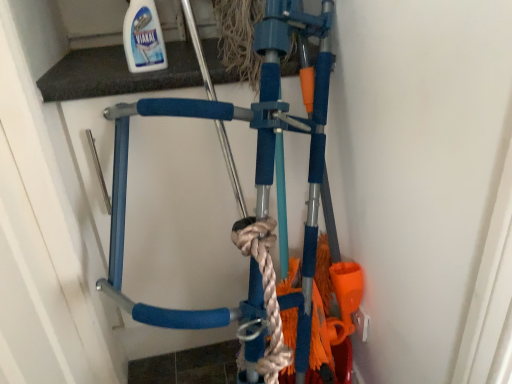
In the scene shown: What is the approximate height of white glossy bottle at upper center?

It is 27.06 centimeters.

Identify the location of white glossy bottle at upper center. The height and width of the screenshot is (384, 512). (143, 38).

Describe the element at coordinates (143, 38) in the screenshot. I see `white glossy bottle at upper center` at that location.

Identify the location of blue foam bicycle at center. The height and width of the screenshot is (384, 512). (242, 195).

The image size is (512, 384). What do you see at coordinates (242, 195) in the screenshot?
I see `blue foam bicycle at center` at bounding box center [242, 195].

Find the location of a particular element. The height and width of the screenshot is (384, 512). white glossy bottle at upper center is located at coordinates (143, 38).

Is white glossy bottle at upper center at the left side of blue foam bicycle at center?

Yes, white glossy bottle at upper center is to the left of blue foam bicycle at center.

Is white glossy bottle at upper center in front of or behind blue foam bicycle at center in the image?

Clearly, white glossy bottle at upper center is in front of blue foam bicycle at center.

Which is behind, point (156, 13) or point (262, 172)?

The point (156, 13) is behind.

From the image's perspective, is white glossy bottle at upper center above or below blue foam bicycle at center?

Based on their image positions, white glossy bottle at upper center is located above blue foam bicycle at center.

From a real-world perspective, is white glossy bottle at upper center positioned above or below blue foam bicycle at center?

Clearly, from a real-world perspective, white glossy bottle at upper center is above blue foam bicycle at center.

From the picture: Considering the sizes of objects white glossy bottle at upper center and blue foam bicycle at center in the image provided, who is wider, white glossy bottle at upper center or blue foam bicycle at center?

blue foam bicycle at center.

Is white glossy bottle at upper center taller than blue foam bicycle at center?

Incorrect, the height of white glossy bottle at upper center is not larger of that of blue foam bicycle at center.

Who is bigger, white glossy bottle at upper center or blue foam bicycle at center?

blue foam bicycle at center.

Is white glossy bottle at upper center inside the boundaries of blue foam bicycle at center, or outside?

white glossy bottle at upper center is located beyond the bounds of blue foam bicycle at center.

Is white glossy bottle at upper center positioned far away from blue foam bicycle at center?

They are positioned close to each other.

Does white glossy bottle at upper center turn towards blue foam bicycle at center?

No, white glossy bottle at upper center is not oriented towards blue foam bicycle at center.

Where is `bicycle below the white glossy bottle at upper center (from a real-world perspective)`? The width and height of the screenshot is (512, 384). bicycle below the white glossy bottle at upper center (from a real-world perspective) is located at coordinates (242, 195).

Can you confirm if blue foam bicycle at center is positioned to the left of white glossy bottle at upper center?

No, blue foam bicycle at center is not to the left of white glossy bottle at upper center.

Who is more distant, blue foam bicycle at center or white glossy bottle at upper center?

Positioned behind is blue foam bicycle at center.

Which is closer to the camera, (300,348) or (152,58)?

Point (300,348).

Based on the photo, from the image's perspective, does blue foam bicycle at center appear lower than white glossy bottle at upper center?

Yes, from the image's perspective, blue foam bicycle at center is below white glossy bottle at upper center.

Based on the photo, from a real-world perspective, is blue foam bicycle at center physically above white glossy bottle at upper center?

No, from a real-world perspective, blue foam bicycle at center is not above white glossy bottle at upper center.

Considering the sizes of blue foam bicycle at center and white glossy bottle at upper center in the image, is blue foam bicycle at center wider or thinner than white glossy bottle at upper center?

In the image, blue foam bicycle at center appears to be wider than white glossy bottle at upper center.

Can you confirm if blue foam bicycle at center is taller than white glossy bottle at upper center?

Correct, blue foam bicycle at center is much taller as white glossy bottle at upper center.

Can you confirm if blue foam bicycle at center is smaller than white glossy bottle at upper center?

No.

Would you say blue foam bicycle at center is outside white glossy bottle at upper center?

Yes.

Is blue foam bicycle at center far from white glossy bottle at upper center?

No, there isn't a large distance between blue foam bicycle at center and white glossy bottle at upper center.

Is blue foam bicycle at center aimed at white glossy bottle at upper center?

No.

Locate an element on the screen. Image resolution: width=512 pixels, height=384 pixels. bicycle beneath the white glossy bottle at upper center (from a real-world perspective) is located at coordinates (242, 195).

You are a GUI agent. You are given a task and a screenshot of the screen. Output one action in this format:
    pyautogui.click(x=<x>, y=<y>)
    Task: Click on the bicycle below the white glossy bottle at upper center (from a real-world perspective)
    This screenshot has height=384, width=512.
    Given the screenshot: What is the action you would take?
    pyautogui.click(x=242, y=195)

This screenshot has height=384, width=512. I want to click on bicycle lying behind the white glossy bottle at upper center, so click(242, 195).